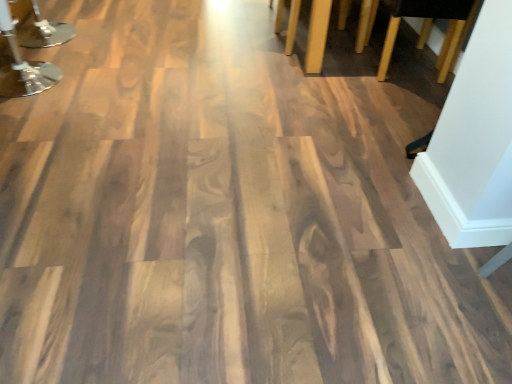
Question: Does wooden table legs at upper right, acting as the 2th furniture starting from the left, turn towards polished chrome table at upper left, arranged as the 2th furniture when viewed from the right?

Choices:
 (A) yes
 (B) no

Answer: (A)

Question: Is wooden table legs at upper right, acting as the 2th furniture starting from the left, far away from polished chrome table at upper left, arranged as the 2th furniture when viewed from the right?

Choices:
 (A) no
 (B) yes

Answer: (B)

Question: Can you confirm if wooden table legs at upper right, acting as the 2th furniture starting from the left, is thinner than polished chrome table at upper left, marked as the 1th furniture in a left-to-right arrangement?

Choices:
 (A) yes
 (B) no

Answer: (B)

Question: From the image's perspective, does wooden table legs at upper right, acting as the 2th furniture starting from the left, appear higher than polished chrome table at upper left, arranged as the 2th furniture when viewed from the right?

Choices:
 (A) no
 (B) yes

Answer: (B)

Question: Can you confirm if wooden table legs at upper right, the first furniture in the right-to-left sequence, is positioned to the left of polished chrome table at upper left, arranged as the 2th furniture when viewed from the right?

Choices:
 (A) no
 (B) yes

Answer: (A)

Question: Is wooden table legs at upper right, the first furniture in the right-to-left sequence, directly adjacent to polished chrome table at upper left, arranged as the 2th furniture when viewed from the right?

Choices:
 (A) yes
 (B) no

Answer: (B)

Question: Is polished chrome table at upper left, marked as the 1th furniture in a left-to-right arrangement, facing towards wooden table legs at upper right, acting as the 2th furniture starting from the left?

Choices:
 (A) no
 (B) yes

Answer: (A)

Question: Is the depth of polished chrome table at upper left, marked as the 1th furniture in a left-to-right arrangement, greater than that of wooden table legs at upper right, the first furniture in the right-to-left sequence?

Choices:
 (A) yes
 (B) no

Answer: (B)

Question: Is wooden table legs at upper right, acting as the 2th furniture starting from the left, located within polished chrome table at upper left, marked as the 1th furniture in a left-to-right arrangement?

Choices:
 (A) no
 (B) yes

Answer: (A)

Question: Can you confirm if polished chrome table at upper left, marked as the 1th furniture in a left-to-right arrangement, is bigger than wooden table legs at upper right, acting as the 2th furniture starting from the left?

Choices:
 (A) no
 (B) yes

Answer: (A)

Question: Considering the relative sizes of polished chrome table at upper left, marked as the 1th furniture in a left-to-right arrangement, and wooden table legs at upper right, acting as the 2th furniture starting from the left, in the image provided, is polished chrome table at upper left, marked as the 1th furniture in a left-to-right arrangement, shorter than wooden table legs at upper right, acting as the 2th furniture starting from the left,?

Choices:
 (A) yes
 (B) no

Answer: (B)

Question: Does polished chrome table at upper left, marked as the 1th furniture in a left-to-right arrangement, have a smaller size compared to wooden table legs at upper right, acting as the 2th furniture starting from the left?

Choices:
 (A) yes
 (B) no

Answer: (A)

Question: Relative to polished chrome table at upper left, marked as the 1th furniture in a left-to-right arrangement, is wooden table legs at upper right, acting as the 2th furniture starting from the left, in front or behind?

Choices:
 (A) front
 (B) behind

Answer: (B)